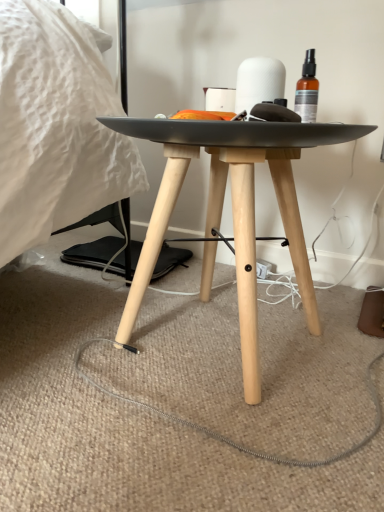
Question: Is matte black table at center bigger or smaller than white matte toilet paper at center?

Choices:
 (A) small
 (B) big

Answer: (B)

Question: Considering the positions of matte black table at center and white matte toilet paper at center in the image, is matte black table at center wider or thinner than white matte toilet paper at center?

Choices:
 (A) thin
 (B) wide

Answer: (B)

Question: From the image's perspective, is matte black table at center above or below white matte toilet paper at center?

Choices:
 (A) above
 (B) below

Answer: (B)

Question: Is white matte toilet paper at center bigger or smaller than matte black table at center?

Choices:
 (A) small
 (B) big

Answer: (A)

Question: In terms of height, does white matte toilet paper at center look taller or shorter compared to matte black table at center?

Choices:
 (A) tall
 (B) short

Answer: (B)

Question: In the image, is white matte toilet paper at center positioned in front of or behind matte black table at center?

Choices:
 (A) front
 (B) behind

Answer: (B)

Question: Considering the positions of point (256, 66) and point (201, 288), is point (256, 66) closer or farther from the camera than point (201, 288)?

Choices:
 (A) closer
 (B) farther

Answer: (A)